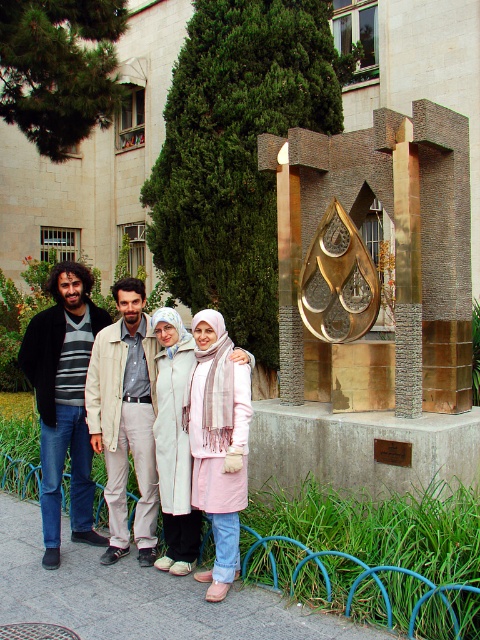
Question: Is light beige coat at center positioned in front of pale pink fabric scarf at center?

Choices:
 (A) no
 (B) yes

Answer: (A)

Question: Which point is farther to the camera?

Choices:
 (A) tan fabric jacket at center
 (B) dark blue jeans at left
 (C) pale pink fabric scarf at center
 (D) light beige coat at center

Answer: (B)

Question: Which point is closer to the camera?

Choices:
 (A) light beige coat at center
 (B) gold metallic sculpture at center

Answer: (A)

Question: Does gold metallic sculpture at center appear on the right side of pale pink fabric scarf at center?

Choices:
 (A) yes
 (B) no

Answer: (A)

Question: Which of the following is the closest to the observer?

Choices:
 (A) (212, 483)
 (B) (57, 460)

Answer: (A)

Question: Is the position of dark blue jeans at left less distant than that of tan fabric jacket at center?

Choices:
 (A) yes
 (B) no

Answer: (B)